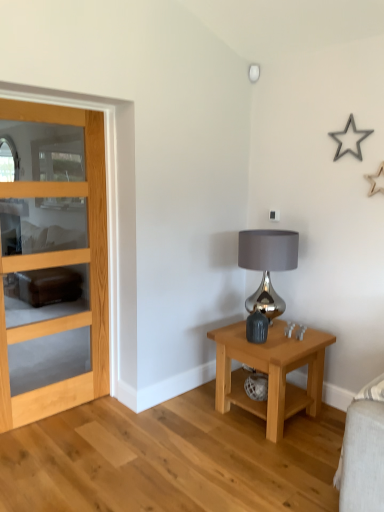
Find the location of a particular element. vacant area that is situated to the right of light wood/glass door at left is located at coordinates (118, 428).